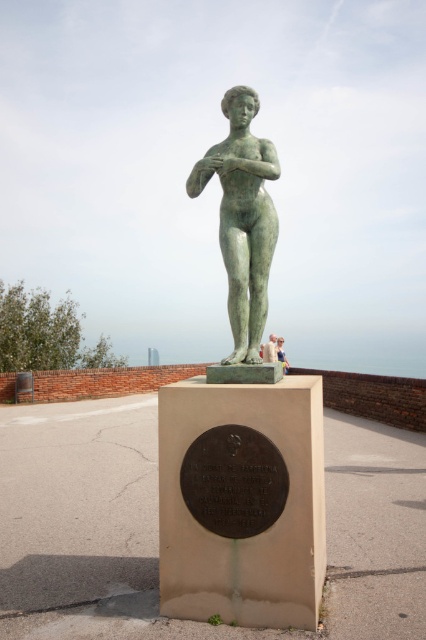
Which is below, green bronze statue at center or light brown wooden bench at center?

light brown wooden bench at center

Who is higher up, green bronze statue at center or light brown wooden bench at center?

Positioned higher is green bronze statue at center.

Is point (230, 291) more distant than point (276, 349)?

That is False.

Find the location of `green bronze statue at center`. green bronze statue at center is located at coordinates (242, 218).

Between point (270, 339) and point (279, 342), which one is positioned in front?

Point (279, 342) is more forward.

From the picture: Is matte bronze statue at center positioned behind light brown wooden bench at center?

No, matte bronze statue at center is closer to the viewer.

Measure the distance between point (264,356) and camera.

A distance of 60.01 feet exists between point (264,356) and camera.

You are a GUI agent. You are given a task and a screenshot of the screen. Output one action in this format:
    pyautogui.click(x=<x>, y=<y>)
    Task: Click on the matte bronze statue at center
    This screenshot has width=426, height=640.
    Given the screenshot: What is the action you would take?
    [x=270, y=349]

Is point (227, 138) farther from viewer compared to point (276, 353)?

No, (227, 138) is closer to viewer.

What do you see at coordinates (242, 218) in the screenshot? I see `green bronze statue at center` at bounding box center [242, 218].

Is point (250, 260) more distant than point (264, 348)?

No, (250, 260) is closer to viewer.

The width and height of the screenshot is (426, 640). What are the coordinates of `green bronze statue at center` in the screenshot? It's located at (242, 218).